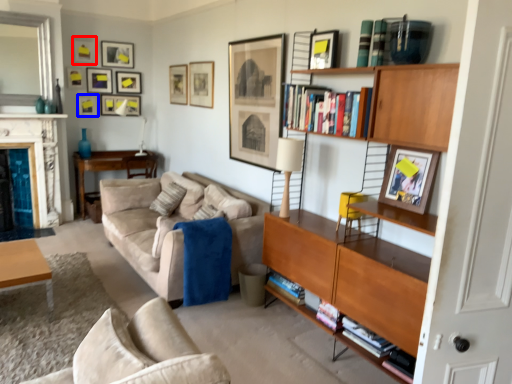
Question: Which of the following is the closest to the observer, picture frame (highlighted by a red box) or picture frame (highlighted by a blue box)?

Choices:
 (A) picture frame
 (B) picture frame

Answer: (A)